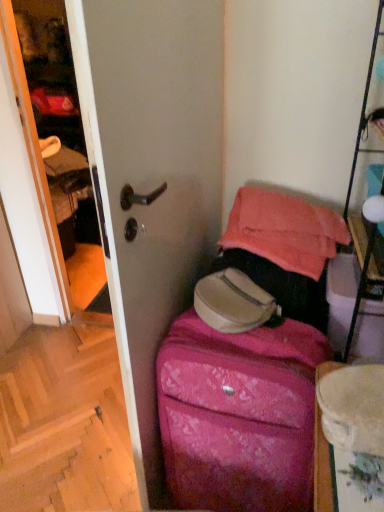
Question: Is wooden at lower left in front of or behind pink textured suitcase at center in the image?

Choices:
 (A) front
 (B) behind

Answer: (B)

Question: Does point (69, 365) appear closer or farther from the camera than point (284, 478)?

Choices:
 (A) farther
 (B) closer

Answer: (A)

Question: Based on their relative distances, which object is farther from the pink textured suitcase at center?

Choices:
 (A) pink fabric suitcase at lower right
 (B) wooden at lower left

Answer: (B)

Question: Estimate the real-world distances between objects in this image. Which object is closer to the pink fabric suitcase at lower right?

Choices:
 (A) pink textured suitcase at center
 (B) wooden at lower left

Answer: (A)